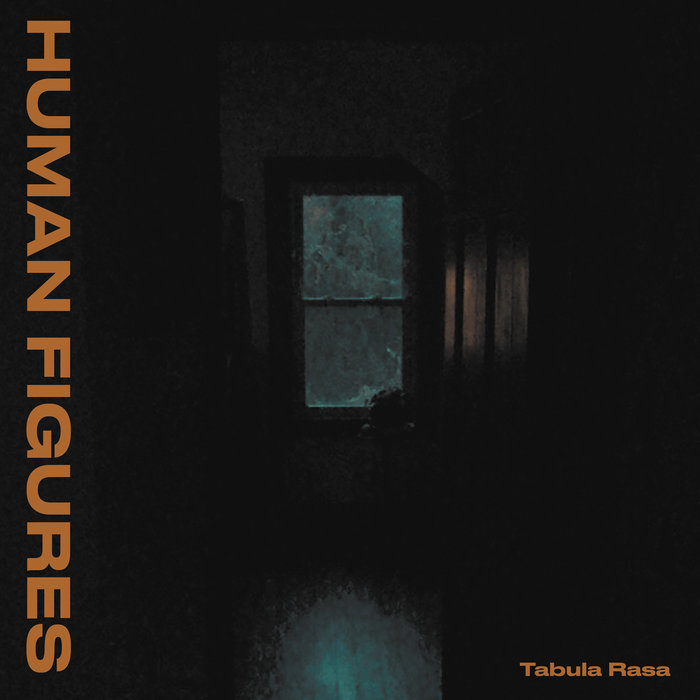
The width and height of the screenshot is (700, 700). What are the coordinates of `small table` in the screenshot? It's located at (388, 435).